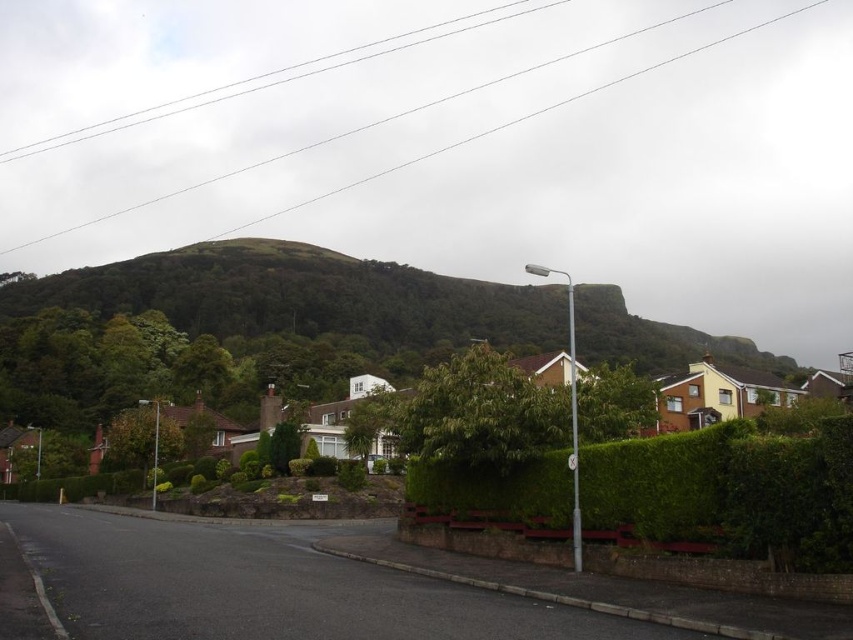
Who is shorter, green leafy hillside at upper center or green leafy hedge at center?

With less height is green leafy hedge at center.

Is point (347, 292) more distant than point (720, 429)?

Yes, it is behind point (720, 429).

Where is `green leafy hillside at upper center`? This screenshot has width=853, height=640. green leafy hillside at upper center is located at coordinates (303, 298).